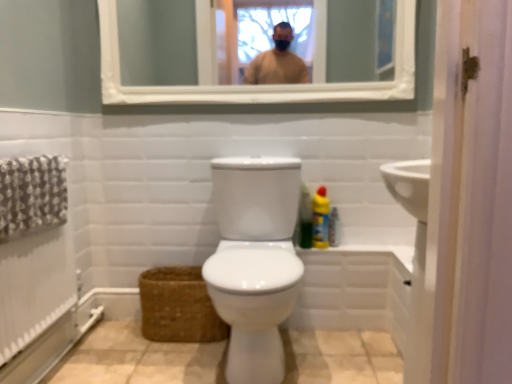
What do you see at coordinates (334, 228) in the screenshot? I see `translucent plastic spray bottle at right` at bounding box center [334, 228].

Locate an element on the screen. The height and width of the screenshot is (384, 512). white glossy bidet at center is located at coordinates (254, 304).

Describe the element at coordinates (254, 304) in the screenshot. Image resolution: width=512 pixels, height=384 pixels. I see `white glossy bidet at center` at that location.

This screenshot has height=384, width=512. In order to click on white wooden mirror at upper center in this screenshot , I will do `click(157, 42)`.

Considering the sizes of white wooden mirror at upper center and yellow plastic bottle at right, the first cleaning product viewed from the right, in the image, is white wooden mirror at upper center bigger or smaller than yellow plastic bottle at right, the first cleaning product viewed from the right,?

Clearly, white wooden mirror at upper center is larger in size than yellow plastic bottle at right, the first cleaning product viewed from the right.

Between white wooden mirror at upper center and yellow plastic bottle at right, which appears as the 2th cleaning product when viewed from the left, which one has larger width?

yellow plastic bottle at right, which appears as the 2th cleaning product when viewed from the left, is wider.

Between white wooden mirror at upper center and yellow plastic bottle at right, which appears as the 2th cleaning product when viewed from the left, which one appears on the right side from the viewer's perspective?

yellow plastic bottle at right, which appears as the 2th cleaning product when viewed from the left, is more to the right.

Is white wooden mirror at upper center wider or thinner than white glossy bidet at center?

In the image, white wooden mirror at upper center appears to be more narrow than white glossy bidet at center.

Does white wooden mirror at upper center come in front of white glossy bidet at center?

No, it is not.

Based on their positions, is white wooden mirror at upper center located to the left or right of white glossy bidet at center?

white wooden mirror at upper center is to the right of white glossy bidet at center.

From a real-world perspective, between white wooden mirror at upper center and white glossy bidet at center, who is vertically higher?

From a 3D spatial view, white wooden mirror at upper center is above.

Which of these two, white wooden mirror at upper center or brown woven basket at lower left, is smaller?

brown woven basket at lower left.

Is white wooden mirror at upper center beside brown woven basket at lower left?

No, white wooden mirror at upper center is not in contact with brown woven basket at lower left.

How much distance is there between white wooden mirror at upper center and brown woven basket at lower left?

The distance of white wooden mirror at upper center from brown woven basket at lower left is 1.37 meters.

From the image's perspective, which object appears higher, white wooden mirror at upper center or brown woven basket at lower left?

From the image's view, white wooden mirror at upper center is above.

Is there a large distance between green matte bottle at right, arranged as the second cleaning product when viewed from the right, and yellow plastic bottle at right, the first cleaning product viewed from the right?

green matte bottle at right, arranged as the second cleaning product when viewed from the right, is actually quite close to yellow plastic bottle at right, the first cleaning product viewed from the right.

Between green matte bottle at right, arranged as the second cleaning product when viewed from the right, and yellow plastic bottle at right, the first cleaning product viewed from the right, which one is positioned in front?

green matte bottle at right, arranged as the second cleaning product when viewed from the right.

Is green matte bottle at right, arranged as the second cleaning product when viewed from the right, facing towards yellow plastic bottle at right, the first cleaning product viewed from the right?

No, green matte bottle at right, arranged as the second cleaning product when viewed from the right, is not turned towards yellow plastic bottle at right, the first cleaning product viewed from the right.

Looking at this image, is white glossy bidet at center oriented towards brown woven basket at lower left?

No, white glossy bidet at center is not aimed at brown woven basket at lower left.

From the image's perspective, which object appears higher, white glossy bidet at center or brown woven basket at lower left?

white glossy bidet at center, from the image's perspective.

Measure the distance from white glossy bidet at center to brown woven basket at lower left.

41.02 centimeters.

Considering the positions of objects white glossy bidet at center and brown woven basket at lower left in the image provided, who is more to the right, white glossy bidet at center or brown woven basket at lower left?

white glossy bidet at center is more to the right.

Could you measure the distance between yellow plastic bottle at right, which appears as the 2th cleaning product when viewed from the left, and white glossy bidet at center?

yellow plastic bottle at right, which appears as the 2th cleaning product when viewed from the left, and white glossy bidet at center are 20.78 inches apart from each other.

How different are the orientations of yellow plastic bottle at right, which appears as the 2th cleaning product when viewed from the left, and white glossy bidet at center in degrees?

0.000302 degrees.

Which of these two, yellow plastic bottle at right, which appears as the 2th cleaning product when viewed from the left, or white glossy bidet at center, is wider?

With larger width is white glossy bidet at center.

From a real-world perspective, which object rests below the other?

From a 3D spatial view, white glossy bidet at center is below.

From the picture: Is brown woven basket at lower left with yellow plastic bottle at right, which appears as the 2th cleaning product when viewed from the left?

They are not placed beside each other.

Does brown woven basket at lower left lie in front of yellow plastic bottle at right, the first cleaning product viewed from the right?

That is True.

Does brown woven basket at lower left turn towards yellow plastic bottle at right, which appears as the 2th cleaning product when viewed from the left?

No, brown woven basket at lower left is not turned towards yellow plastic bottle at right, which appears as the 2th cleaning product when viewed from the left.

From a real-world perspective, starting from the white wooden mirror at upper center, which cleaning product is the 2nd one below it? Please provide its 2D coordinates.

[(320, 219)]

Where is `bidet on the left of white wooden mirror at upper center`? bidet on the left of white wooden mirror at upper center is located at coordinates (254, 304).

Considering their positions, is green matte bottle at right, arranged as the second cleaning product when viewed from the right, positioned closer to white glossy bidet at center than brown woven basket at lower left?

The object closer to white glossy bidet at center is brown woven basket at lower left.

From the image, which object appears to be nearer to white glossy bidet at center, yellow plastic bottle at right, the first cleaning product viewed from the right, or brown woven basket at lower left?

Based on the image, brown woven basket at lower left appears to be nearer to white glossy bidet at center.

When comparing their distances from brown woven basket at lower left, does white wooden mirror at upper center or green matte bottle at right, arranged as the first cleaning product when viewed from the left, seem closer?

green matte bottle at right, arranged as the first cleaning product when viewed from the left, is closer to brown woven basket at lower left.

Estimate the real-world distances between objects in this image. Which object is further from brown woven basket at lower left, white glossy bidet at center or green matte bottle at right, arranged as the first cleaning product when viewed from the left?

green matte bottle at right, arranged as the first cleaning product when viewed from the left, is positioned further to the anchor brown woven basket at lower left.

Which object lies further to the anchor point brown woven basket at lower left, white glossy bidet at center or white wooden mirror at upper center?

white wooden mirror at upper center is further to brown woven basket at lower left.

Based on their spatial positions, is white wooden mirror at upper center or brown woven basket at lower left further from white glossy bidet at center?

Based on the image, white wooden mirror at upper center appears to be further to white glossy bidet at center.

When comparing their distances from green matte bottle at right, arranged as the second cleaning product when viewed from the right, does white glossy bidet at center or translucent plastic spray bottle at right seem closer?

translucent plastic spray bottle at right is closer to green matte bottle at right, arranged as the second cleaning product when viewed from the right.

Looking at the image, which one is located closer to white wooden mirror at upper center, white glossy bidet at center or yellow plastic bottle at right, which appears as the 2th cleaning product when viewed from the left?

The object closer to white wooden mirror at upper center is yellow plastic bottle at right, which appears as the 2th cleaning product when viewed from the left.

Where is `toiletry between white wooden mirror at upper center and brown woven basket at lower left vertically`? toiletry between white wooden mirror at upper center and brown woven basket at lower left vertically is located at coordinates (334, 228).

Where is `cleaning product between white wooden mirror at upper center and yellow plastic bottle at right, the first cleaning product viewed from the right, in the vertical direction`? This screenshot has width=512, height=384. cleaning product between white wooden mirror at upper center and yellow plastic bottle at right, the first cleaning product viewed from the right, in the vertical direction is located at coordinates (305, 218).

Where is `basket between white glossy bidet at center and green matte bottle at right, arranged as the second cleaning product when viewed from the right, from front to back`? basket between white glossy bidet at center and green matte bottle at right, arranged as the second cleaning product when viewed from the right, from front to back is located at coordinates (178, 306).

Identify the location of basket between white glossy bidet at center and yellow plastic bottle at right, the first cleaning product viewed from the right, from front to back. (178, 306).